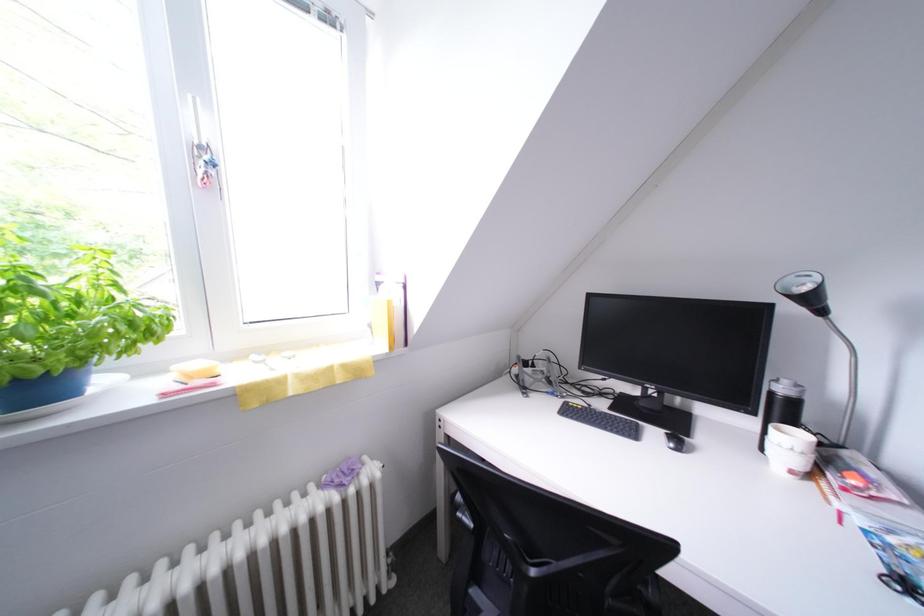
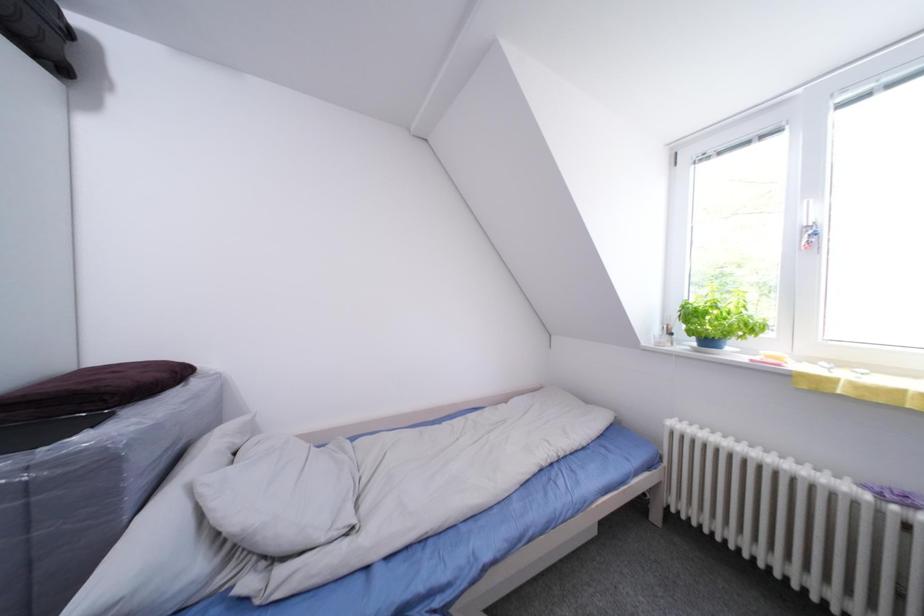
Question: The camera is either moving clockwise (left) or counter-clockwise (right) around the object. The first image is from the beginning of the video and the second image is from the end. Is the camera moving left or right when shooting the video?

Choices:
 (A) Left
 (B) Right

Answer: (B)